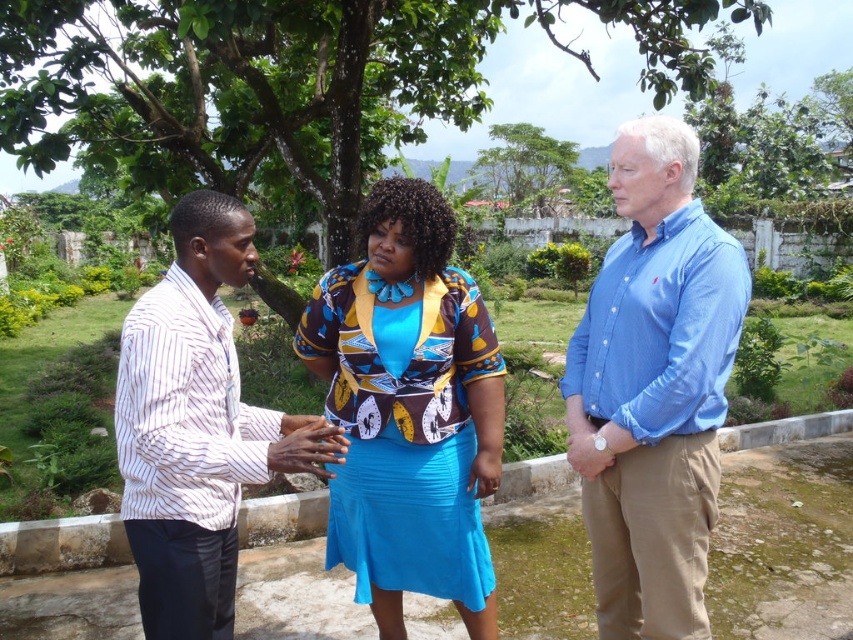
Who is positioned more to the right, blue fabric skirt at center or green leafy tree at upper center?

From the viewer's perspective, green leafy tree at upper center appears more on the right side.

Between blue fabric skirt at center and green leafy tree at upper center, which one has less height?

Standing shorter between the two is blue fabric skirt at center.

Which is in front, point (440, 513) or point (514, 204)?

Point (440, 513)

This screenshot has width=853, height=640. In order to click on blue fabric skirt at center in this screenshot , I will do `click(409, 410)`.

Does blue fabric skirt at center appear on the left side of white striped shirt at left?

Incorrect, blue fabric skirt at center is not on the left side of white striped shirt at left.

Does point (426, 186) come behind point (238, 474)?

Yes, point (426, 186) is behind point (238, 474).

Identify the location of blue fabric skirt at center. The height and width of the screenshot is (640, 853). (409, 410).

Is green leafy tree at center further to camera compared to blue fabric skirt at center?

Yes.

Who is more forward, (19, 4) or (474, 481)?

Point (474, 481)

Where is `green leafy tree at center`? The height and width of the screenshot is (640, 853). green leafy tree at center is located at coordinates pyautogui.click(x=289, y=81).